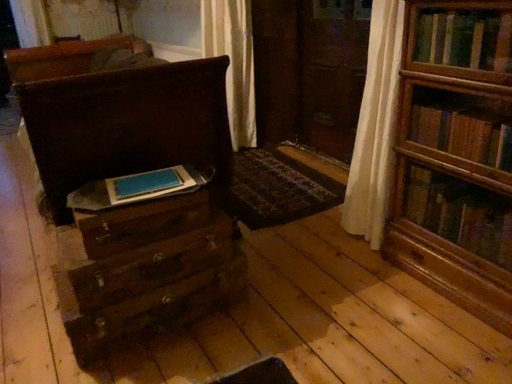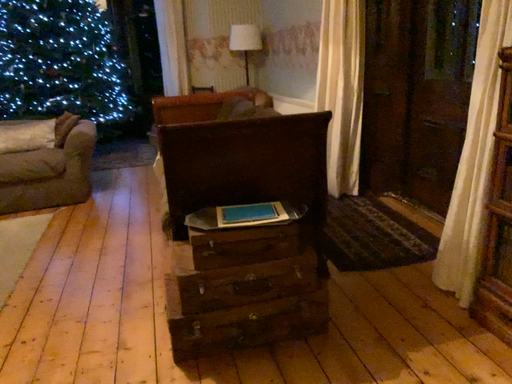
Question: Which way did the camera rotate in the video?

Choices:
 (A) rotated left
 (B) rotated right

Answer: (A)